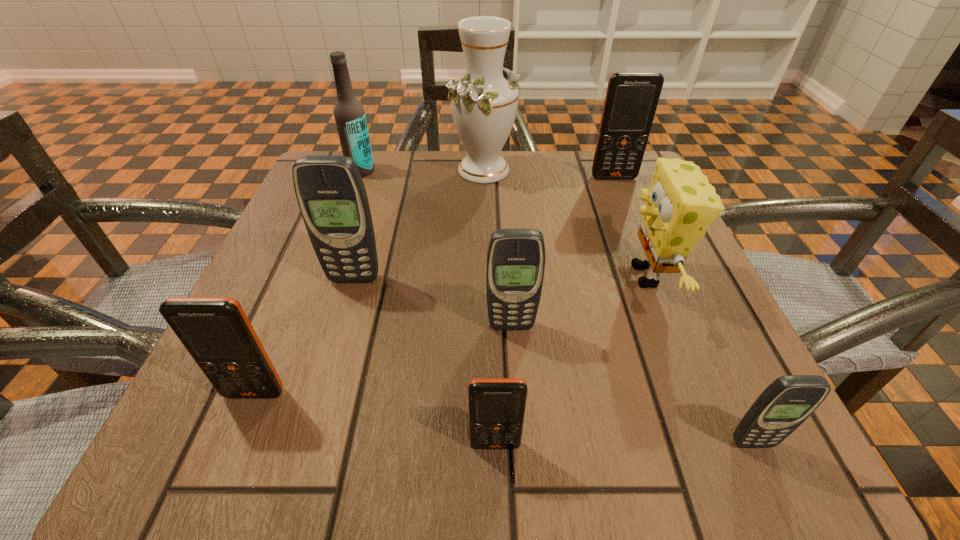
Image resolution: width=960 pixels, height=540 pixels. Identify the location of free location located 0.330m on the face of the yellow sponge. (424, 276).

Identify the location of blank space located on the face of the yellow sponge. (454, 276).

Locate an element on the screen. Image resolution: width=960 pixels, height=540 pixels. free space located 0.150m on the screen of the second gray cellular telephone from right to left is located at coordinates (517, 424).

The height and width of the screenshot is (540, 960). Identify the location of free space located on the screen of the second biggest orange cellular telephone. (236, 437).

Locate an element on the screen. Image resolution: width=960 pixels, height=540 pixels. vase that is at the far edge is located at coordinates (484, 102).

The height and width of the screenshot is (540, 960). What are the coordinates of `beer bottle that is at the far edge` in the screenshot? It's located at (349, 114).

Identify the location of cellular telephone that is at the far edge. (631, 100).

Image resolution: width=960 pixels, height=540 pixels. What are the coordinates of `beer bottle that is at the left edge` in the screenshot? It's located at (349, 114).

Where is `sponge present at the right edge`? sponge present at the right edge is located at coordinates (680, 204).

You are a GUI agent. You are given a task and a screenshot of the screen. Output one action in this format:
    pyautogui.click(x=<x>, y=<y>)
    Task: Click on the object situated at the far left corner
    
    Given the screenshot: What is the action you would take?
    pyautogui.click(x=349, y=114)